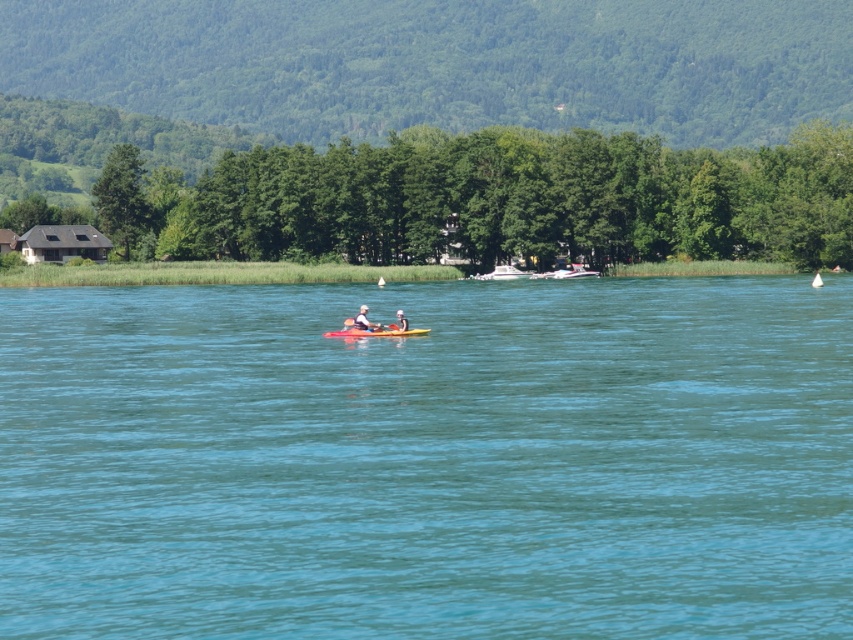
Is point (115, 225) more distant than point (572, 266)?

Yes, point (115, 225) is farther from viewer.

Which is behind, point (846, 253) or point (560, 275)?

Point (846, 253)

The image size is (853, 640). What are the coordinates of `green leafy trees at center` in the screenshot? It's located at tap(482, 200).

Does white plastic boat at center have a greater width compared to white glossy boat at center?

Yes.

Is the position of white plastic boat at center less distant than that of white glossy boat at center?

Yes, white plastic boat at center is closer to the viewer.

The image size is (853, 640). Describe the element at coordinates (567, 273) in the screenshot. I see `white plastic boat at center` at that location.

At what (x,y) coordinates should I click in order to perform the action: click on white plastic boat at center. Please return your answer as a coordinate pair (x, y). Looking at the image, I should click on (567, 273).

Is green leafy tree at upper left above white glossy boat at center?

Indeed, green leafy tree at upper left is positioned over white glossy boat at center.

Who is taller, green leafy tree at upper left or white glossy boat at center?

green leafy tree at upper left

Describe the element at coordinates (122, 196) in the screenshot. I see `green leafy tree at upper left` at that location.

This screenshot has height=640, width=853. Identify the location of green leafy tree at upper left. (122, 196).